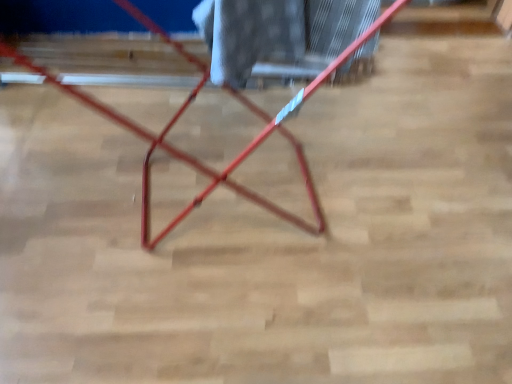
You are a GUI agent. You are given a task and a screenshot of the screen. Output one action in this format:
    pyautogui.click(x=<x>, y=<y>)
    Task: Click on the vacant area that is in front of metallic red ladder at center
    The height and width of the screenshot is (384, 512).
    Given the screenshot: What is the action you would take?
    pyautogui.click(x=202, y=325)